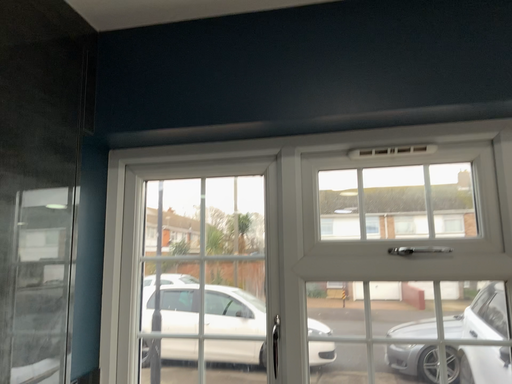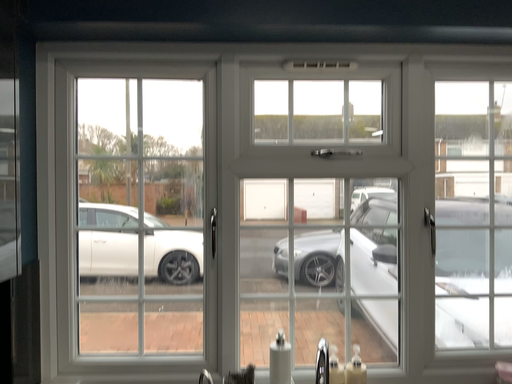
Question: Which way did the camera rotate in the video?

Choices:
 (A) rotated downward
 (B) rotated upward

Answer: (A)